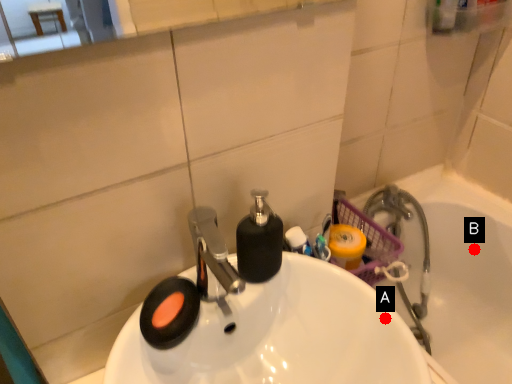
Question: Two points are circled on the image, labeled by A and B beside each circle. Which point appears farthest from the camera in this image?

Choices:
 (A) A is further
 (B) B is further

Answer: (B)